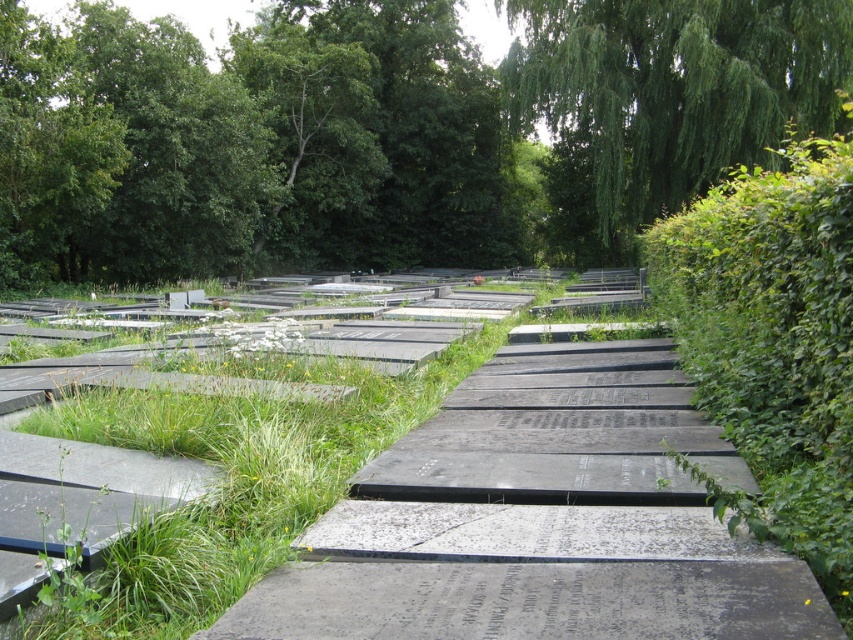
Question: Which object appears closest to the camera in this image?

Choices:
 (A) green leafy hedge at right
 (B) green leafy tree at upper center

Answer: (A)

Question: Is green leafy tree at upper center to the right of green leafy tree at upper right from the viewer's perspective?

Choices:
 (A) no
 (B) yes

Answer: (A)

Question: Estimate the real-world distances between objects in this image. Which object is closer to the green leafy tree at upper right?

Choices:
 (A) green leafy tree at upper center
 (B) green leafy hedge at right

Answer: (B)

Question: Which point is farther to the camera?

Choices:
 (A) green leafy tree at upper right
 (B) green leafy hedge at right

Answer: (A)

Question: Is green leafy tree at upper center smaller than green leafy tree at upper right?

Choices:
 (A) no
 (B) yes

Answer: (A)

Question: Is green leafy tree at upper center to the left of green leafy tree at upper right from the viewer's perspective?

Choices:
 (A) no
 (B) yes

Answer: (B)